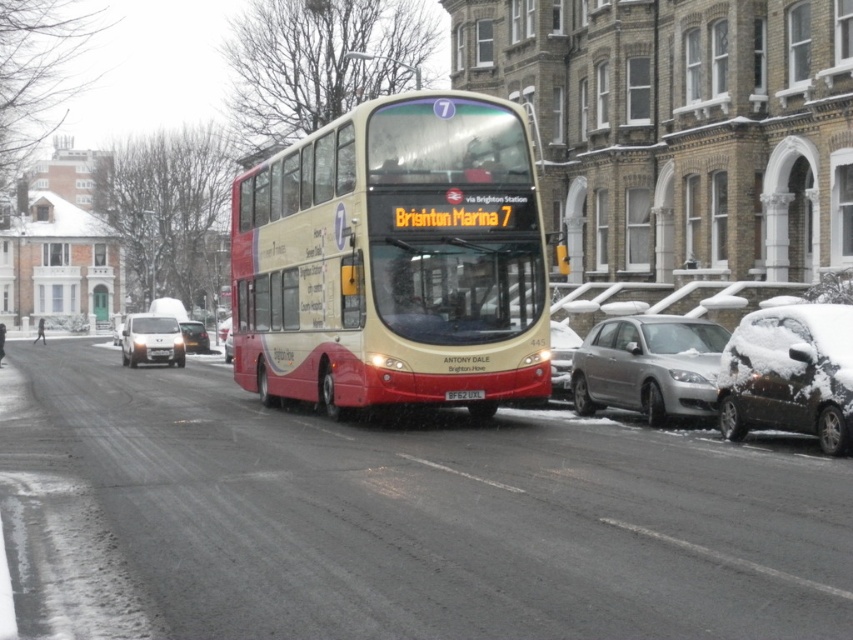
Is snow-covered car at right positioned at the back of white plastic license plate at center?

That is False.

Is point (734, 435) positioned before point (167, 348)?

That is True.

Identify the location of snow-covered car at right. The image size is (853, 640). (788, 374).

Consider the image. Is white plastic license plate at center further to camera compared to metallic silver car at center?

Yes.

Is white plastic license plate at center positioned before metallic silver car at center?

No, it is behind metallic silver car at center.

Which is in front, point (157, 349) or point (229, 342)?

Positioned in front is point (157, 349).

Image resolution: width=853 pixels, height=640 pixels. Find the location of `white plastic license plate at center`. white plastic license plate at center is located at coordinates (160, 353).

Does silver metallic van at center appear over metallic silver car at center?

Correct, silver metallic van at center is located above metallic silver car at center.

Is silver metallic van at center closer to the viewer compared to metallic silver car at center?

No, it is behind metallic silver car at center.

What do you see at coordinates (194, 337) in the screenshot? This screenshot has width=853, height=640. I see `silver metallic van at center` at bounding box center [194, 337].

The height and width of the screenshot is (640, 853). What are the coordinates of `silver metallic van at center` in the screenshot? It's located at (194, 337).